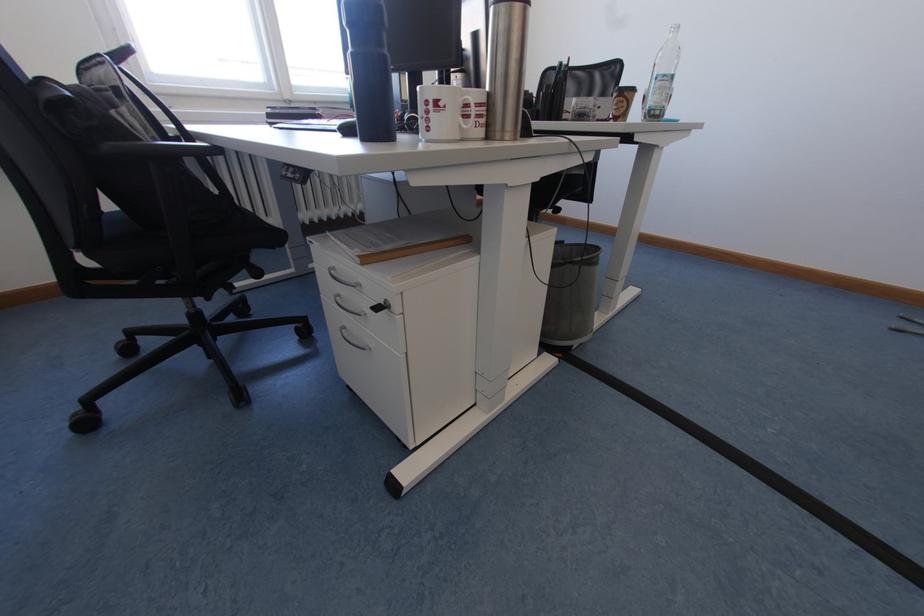
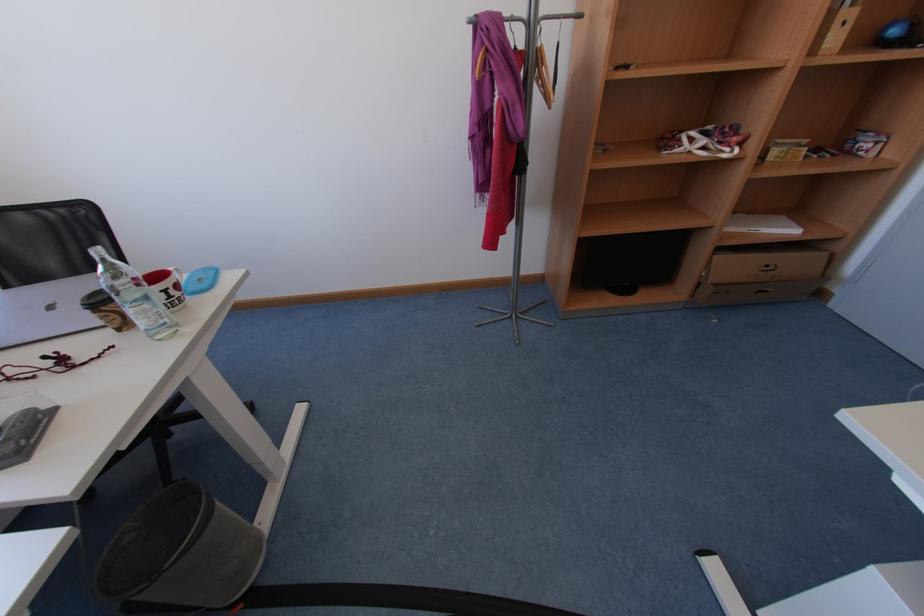
How did the camera likely rotate?

The camera's rotation is toward right-down.